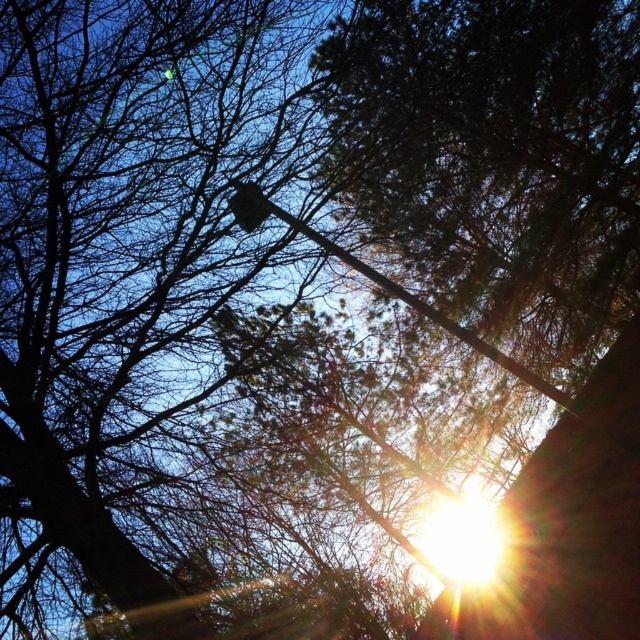
Question: Does bright sun at upper center appear on the right side of smooth metal pole at center?

Choices:
 (A) yes
 (B) no

Answer: (A)

Question: Does smooth metal pole at center have a smaller size compared to metallic gray traffic light at upper center?

Choices:
 (A) no
 (B) yes

Answer: (B)

Question: Which object is positioned closest to the bright sun at upper center?

Choices:
 (A) metallic gray traffic light at upper center
 (B) smooth metal pole at center

Answer: (B)

Question: Which point is closer to the camera?

Choices:
 (A) (349, 260)
 (B) (234, 211)

Answer: (B)

Question: Is smooth metal pole at center above metallic gray traffic light at upper center?

Choices:
 (A) no
 (B) yes

Answer: (A)

Question: Which point is closer to the camera?

Choices:
 (A) smooth metal pole at center
 (B) metallic gray traffic light at upper center

Answer: (B)